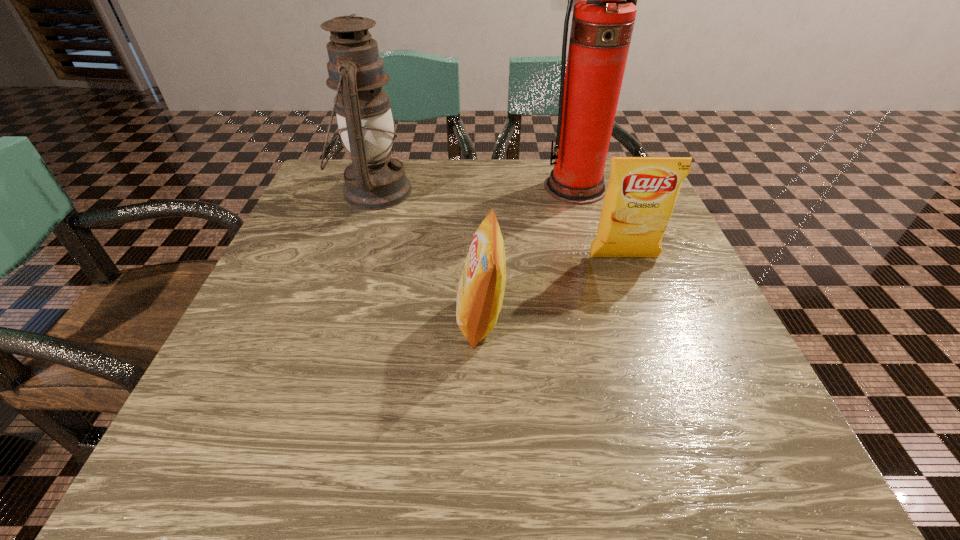
Where is `vacant area that lies between the tallest object and the shortest object`? This screenshot has height=540, width=960. vacant area that lies between the tallest object and the shortest object is located at coordinates (528, 253).

The height and width of the screenshot is (540, 960). What are the coordinates of `vacant space that is in between the nearer crisp (potato chip) and the leftmost object` in the screenshot? It's located at (427, 255).

Where is `vacant point located between the oil lamp and the nearer crisp (potato chip)`? This screenshot has height=540, width=960. vacant point located between the oil lamp and the nearer crisp (potato chip) is located at coordinates (427, 255).

Identify the location of unoccupied area between the shorter crisp (potato chip) and the taller crisp (potato chip). The width and height of the screenshot is (960, 540). (552, 288).

You are a GUI agent. You are given a task and a screenshot of the screen. Output one action in this format:
    pyautogui.click(x=<x>, y=<y>)
    Task: Click on the object that is the closest to the third shortest object
    
    Given the screenshot: What is the action you would take?
    pyautogui.click(x=480, y=292)

Find the location of `the third closest object relative to the farther crisp (potato chip)`. the third closest object relative to the farther crisp (potato chip) is located at coordinates (373, 181).

Identify the location of vacant space that satisfies the following two spatial constraints: 1. on the front of the third farthest object with the logo; 2. on the front-facing side of the nearer crisp (potato chip). Image resolution: width=960 pixels, height=540 pixels. (646, 318).

Image resolution: width=960 pixels, height=540 pixels. Identify the location of vacant area that satisfies the following two spatial constraints: 1. at the discharge end of the fire extinguisher; 2. on the front-facing side of the shorter crisp (potato chip). pos(613,318).

What are the coordinates of `vacant space that satisfies the following two spatial constraints: 1. on the front of the third tallest object with the logo; 2. on the front-facing side of the nearer crisp (potato chip)` in the screenshot? It's located at (646, 318).

The image size is (960, 540). Find the location of `vacant space that satisfies the following two spatial constraints: 1. on the front of the farther crisp (potato chip) with the logo; 2. on the front-facing side of the shorter crisp (potato chip)`. vacant space that satisfies the following two spatial constraints: 1. on the front of the farther crisp (potato chip) with the logo; 2. on the front-facing side of the shorter crisp (potato chip) is located at coordinates (646, 318).